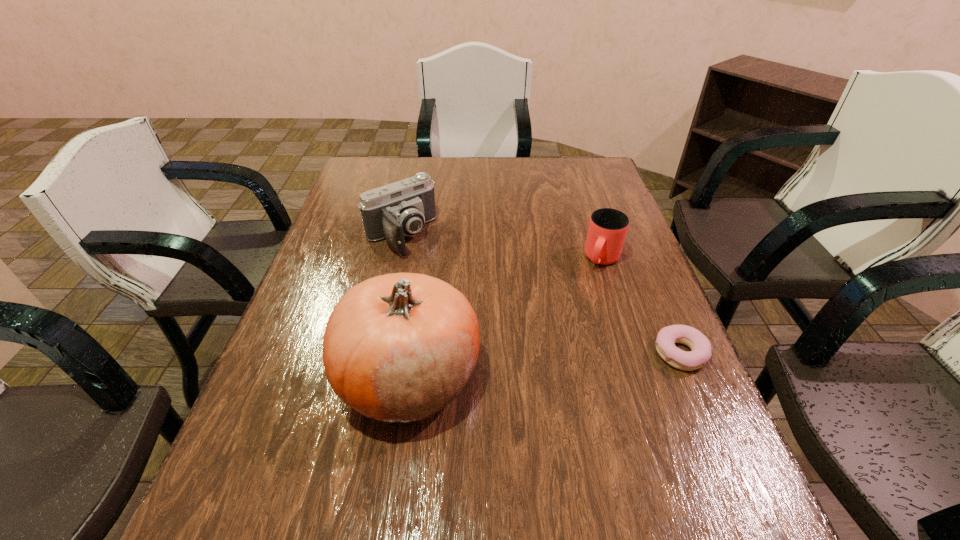
The height and width of the screenshot is (540, 960). In order to click on vacant space located on the handle side of the second shortest object in this screenshot , I will do `click(581, 309)`.

Where is `vacant region located on the handle side of the second shortest object`? The image size is (960, 540). vacant region located on the handle side of the second shortest object is located at coordinates (543, 383).

In order to click on object located at the near edge in this screenshot , I will do `click(397, 348)`.

Locate an element on the screen. The height and width of the screenshot is (540, 960). pumpkin situated at the left edge is located at coordinates (397, 348).

You are a GUI agent. You are given a task and a screenshot of the screen. Output one action in this format:
    pyautogui.click(x=<x>, y=<y>)
    Task: Click on the camera present at the left edge
    This screenshot has height=540, width=960.
    Given the screenshot: What is the action you would take?
    pos(401,208)

Find the location of a particular element. doughnut that is at the right edge is located at coordinates (700, 346).

Locate an element on the screen. The width and height of the screenshot is (960, 540). cup present at the right edge is located at coordinates (607, 230).

What are the coordinates of `object present at the near left corner` in the screenshot? It's located at (397, 348).

Locate an element on the screen. vacant space at the far edge of the desktop is located at coordinates (531, 165).

Find the location of `vacant space at the near edge of the desktop`. vacant space at the near edge of the desktop is located at coordinates (565, 465).